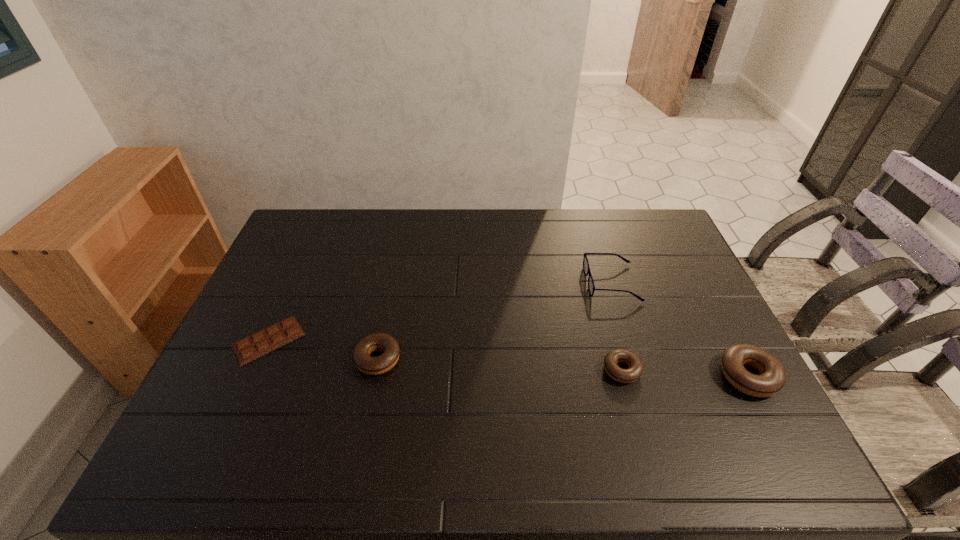
To ensure equal spacing by inserting another doughnut among them, please point out a vacant spot for this new doughnut. Please provide its 2D coordinates. Your answer should be formatted as a tuple, i.e. [(x, y)], where the tuple contains the x and y coordinates of a point satisfying the conditions above.

[(498, 364)]